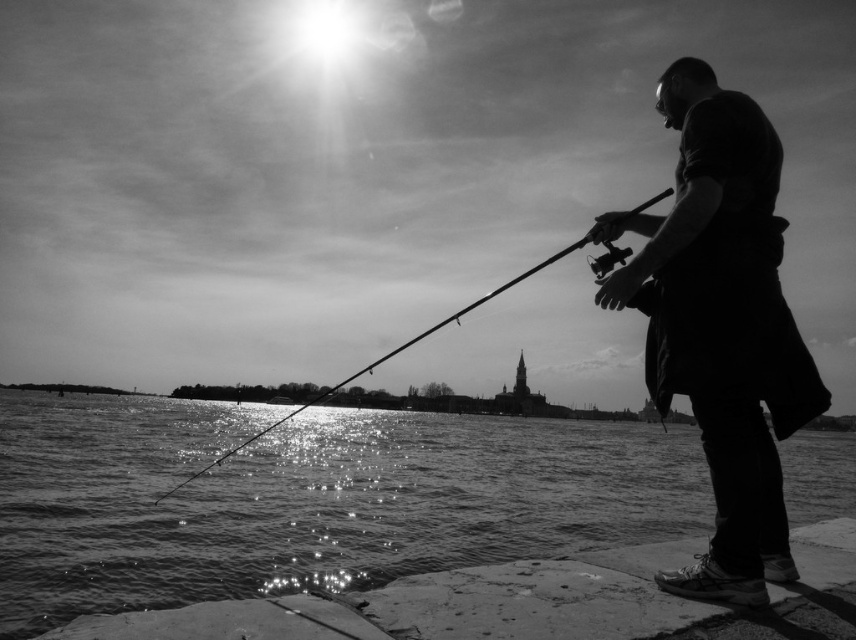
Consider the image. Between sparkling water at lower center and smooth rod fishing pole at center, which one has more height?

With more height is smooth rod fishing pole at center.

Does point (126, 493) come in front of point (476, 301)?

Yes, point (126, 493) is in front of point (476, 301).

Identify the location of sparkling water at lower center. The image size is (856, 640). (307, 499).

Is sparkling water at lower center smaller than dark fabric shirt at right?

Incorrect, sparkling water at lower center is not smaller in size than dark fabric shirt at right.

Which is more to the left, sparkling water at lower center or dark fabric shirt at right?

Positioned to the left is sparkling water at lower center.

Where is `sparkling water at lower center`? sparkling water at lower center is located at coordinates (307, 499).

Is point (629, 282) more distant than point (551, 260)?

No, it is not.

Is dark fabric shirt at right to the left of smooth rod fishing pole at center from the viewer's perspective?

Incorrect, dark fabric shirt at right is not on the left side of smooth rod fishing pole at center.

Which is in front, point (637, 259) or point (525, 272)?

Point (637, 259) is more forward.

Identify the location of dark fabric shirt at right. (721, 324).